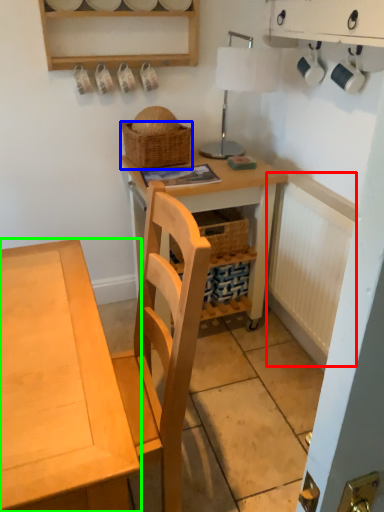
Question: Considering the real-world distances, which object is closest to radiator (highlighted by a red box)? picnic basket (highlighted by a blue box) or desk (highlighted by a green box).

Choices:
 (A) picnic basket
 (B) desk

Answer: (A)